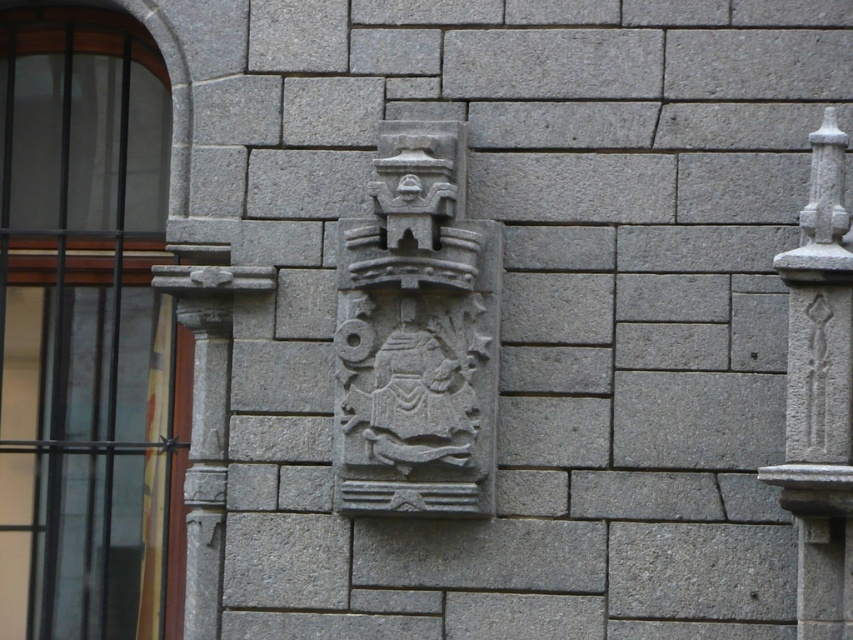
Between matte glass window at center left and gray stone crest at center, which one is positioned higher?

gray stone crest at center is above.

Can you confirm if matte glass window at center left is wider than gray stone crest at center?

Correct, the width of matte glass window at center left exceeds that of gray stone crest at center.

Does point (160, 353) lie behind point (492, 252)?

That is True.

The image size is (853, 640). What are the coordinates of `matte glass window at center left` in the screenshot? It's located at (86, 333).

Consider the image. Does gray stone crest at center lie behind gray stone pillar at right?

Yes.

At what (x,y) coordinates should I click in order to perform the action: click on gray stone crest at center. Please return your answer as a coordinate pair (x, y). This screenshot has height=640, width=853. Looking at the image, I should click on (416, 333).

This screenshot has width=853, height=640. What are the coordinates of `gray stone crest at center` in the screenshot? It's located at [416, 333].

Based on the photo, is matte glass window at center left behind gray stone pillar at right?

That is True.

Who is positioned more to the left, matte glass window at center left or gray stone pillar at right?

From the viewer's perspective, matte glass window at center left appears more on the left side.

Is point (125, 140) positioned behind point (817, 577)?

Yes, it is behind point (817, 577).

At what (x,y) coordinates should I click in order to perform the action: click on matte glass window at center left. Please return your answer as a coordinate pair (x, y). The height and width of the screenshot is (640, 853). Looking at the image, I should click on (86, 333).